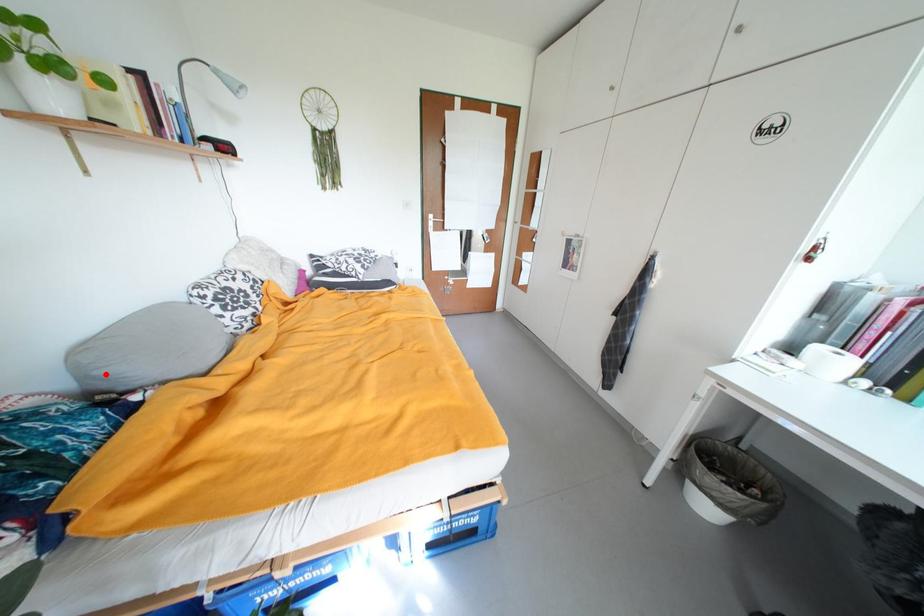
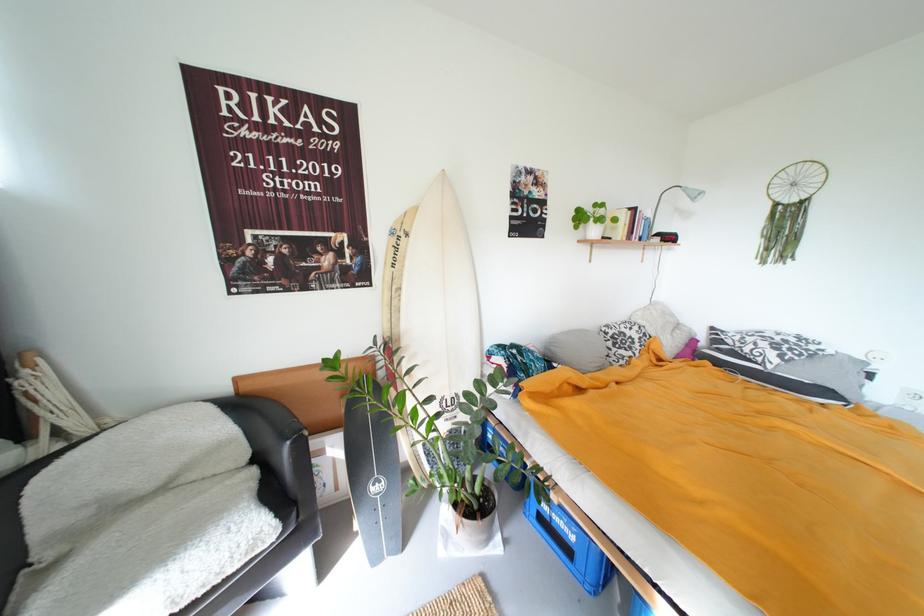
The point at the highlighted location is marked in the first image. Where is the corresponding point in the second image?

(560, 350)